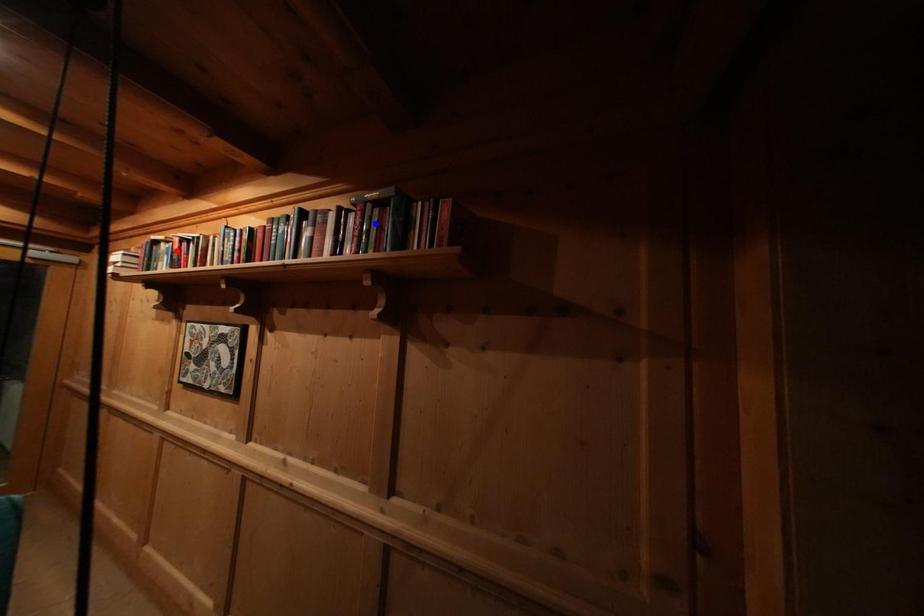
Question: Two points are marked on the image. Which point is closer to the camera?

Choices:
 (A) Blue point is closer.
 (B) Red point is closer.

Answer: (A)